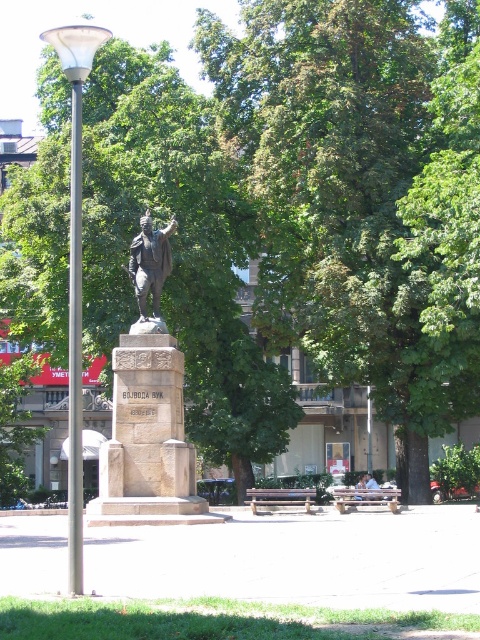
Question: Which is nearer to the wooden bench at center?

Choices:
 (A) light blue fabric shirt at center
 (B) polished bronze statue at center

Answer: (A)

Question: Based on their relative distances, which object is nearer to the light brown wooden bench at center?

Choices:
 (A) polished bronze statue at center
 (B) light blue fabric shirt at center
 (C) wooden bench at center
 (D) silver metallic pole at left

Answer: (B)

Question: Does bronze statue at center have a smaller size compared to wooden park bench at center?

Choices:
 (A) no
 (B) yes

Answer: (B)

Question: Which of these objects is positioned farthest from the polished bronze statue at center?

Choices:
 (A) light brown wooden bench at center
 (B) light blue fabric shirt at center
 (C) wooden park bench at center

Answer: (A)

Question: Observing the image, what is the correct spatial positioning of polished bronze statue at center in reference to silver metallic pole at left?

Choices:
 (A) right
 (B) left

Answer: (A)

Question: From the image, what is the correct spatial relationship of polished bronze statue at center in relation to wooden bench at center?

Choices:
 (A) left
 (B) right

Answer: (A)